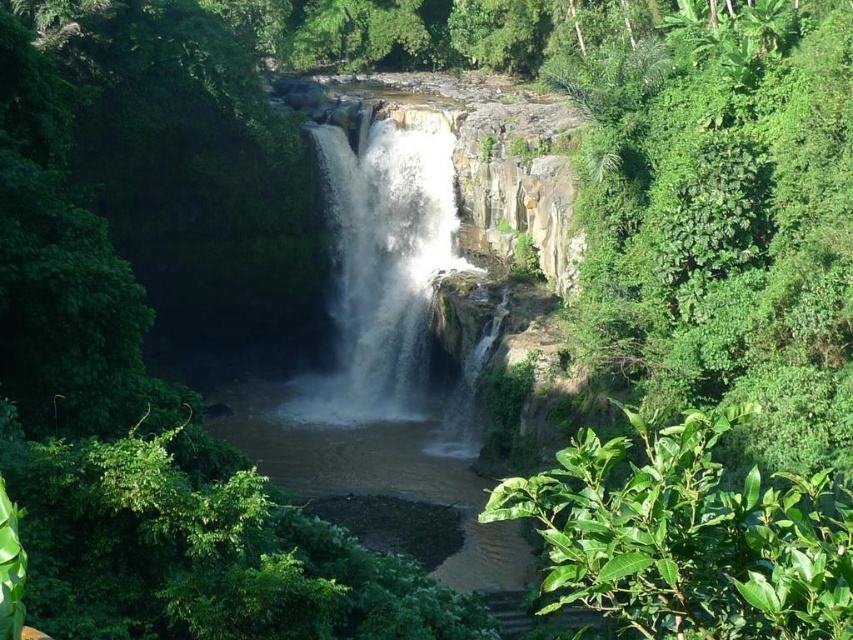
Can you confirm if green leafy plant at lower right is thinner than white frothy water at center?

No, green leafy plant at lower right is not thinner than white frothy water at center.

Does green leafy plant at lower right have a greater height compared to white frothy water at center?

Incorrect, green leafy plant at lower right's height is not larger of white frothy water at center's.

The height and width of the screenshot is (640, 853). What do you see at coordinates (688, 536) in the screenshot? I see `green leafy plant at lower right` at bounding box center [688, 536].

In order to click on green leafy plant at lower right in this screenshot , I will do `click(688, 536)`.